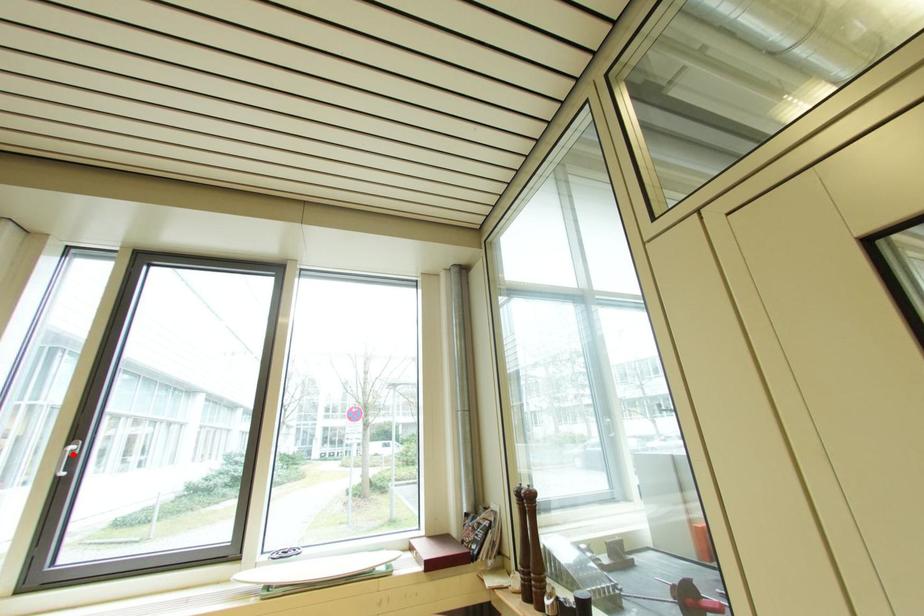
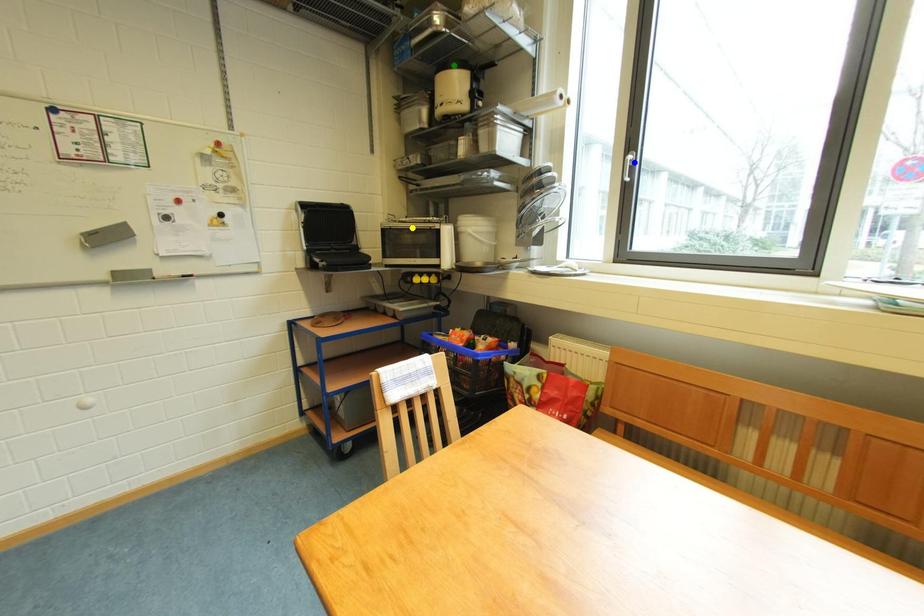
Question: I am providing you with two images of the same scene from different viewpoints. A red point is marked on the first image. You are given multiple points on the second image. Which point in image 2 represents the same 3d spot as the red point in image 1?

Choices:
 (A) blue point
 (B) yellow point
 (C) green point

Answer: (A)